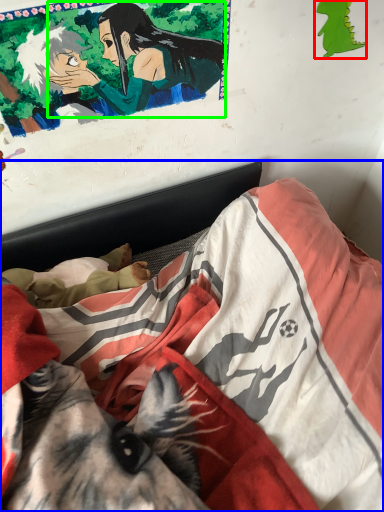
Question: Which object is the farthest from art (highlighted by a red box)? Choose among these: bed (highlighted by a blue box) or woman (highlighted by a green box).

Choices:
 (A) bed
 (B) woman

Answer: (A)